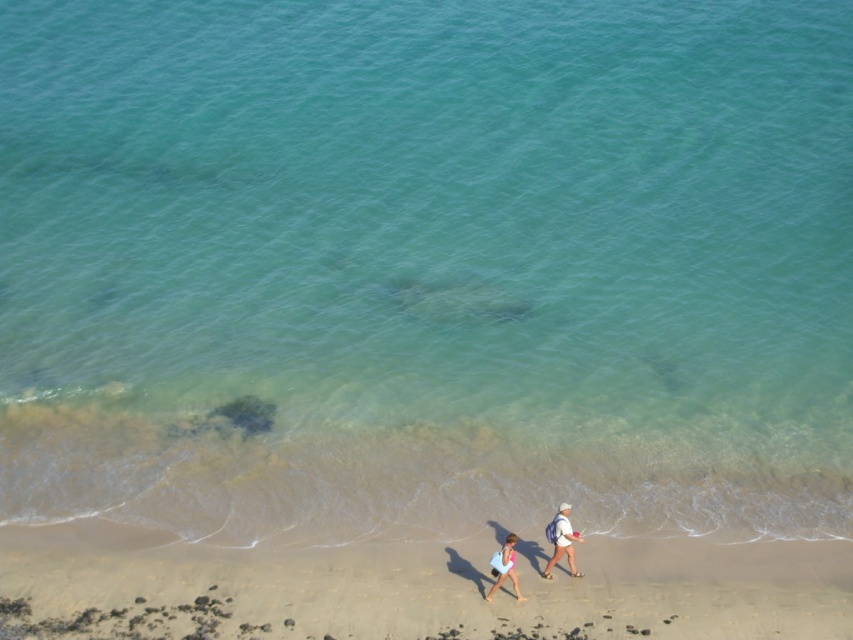
You are a photographer standing on the beach and want to capture both the white cotton shirt at lower center and the white fabric backpack at lower center in your photo. Which object should you focus on first to ensure both are in frame?

You should focus on the white cotton shirt at lower center first because it is shorter than the white fabric backpack at lower center, so adjusting the camera angle to include the taller backpack will naturally include the shirt as well.

You are standing at the center of the beach and want to locate the white cotton shirt at lower center. According to the coordinates provided, in which direction should you look to find it?

The white cotton shirt at lower center is located at point coordinates (x=561, y=540). Since the coordinate system is normalized, with the origin at the top left corner, 0.845 on the x axis means it is 84.5 percent from the left edge towards the right, and 0.659 on the y axis means it is 65.9 percent from the top edge downwards. Therefore, you should look towards the lower right direction to find the white cotton shirt at lower center.